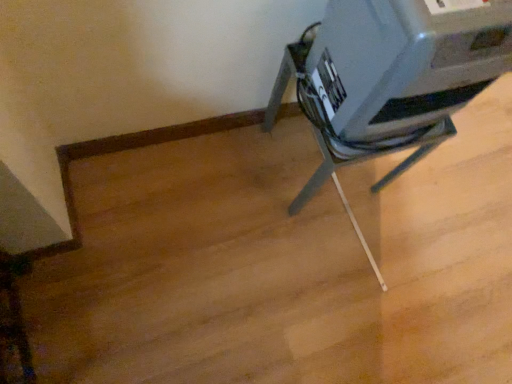
I want to click on free spot to the right of metallic gray printer at center, so click(x=406, y=208).